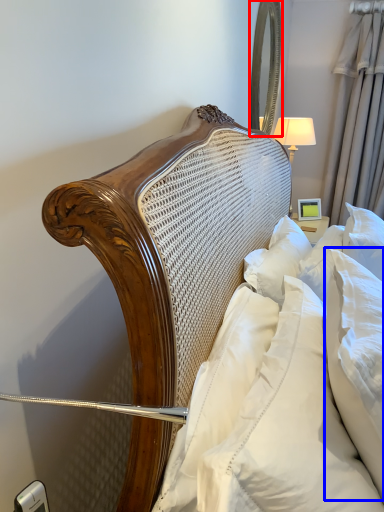
Question: Which object appears farthest to the camera in this image, mirror (highlighted by a red box) or pillow (highlighted by a blue box)?

Choices:
 (A) mirror
 (B) pillow

Answer: (A)